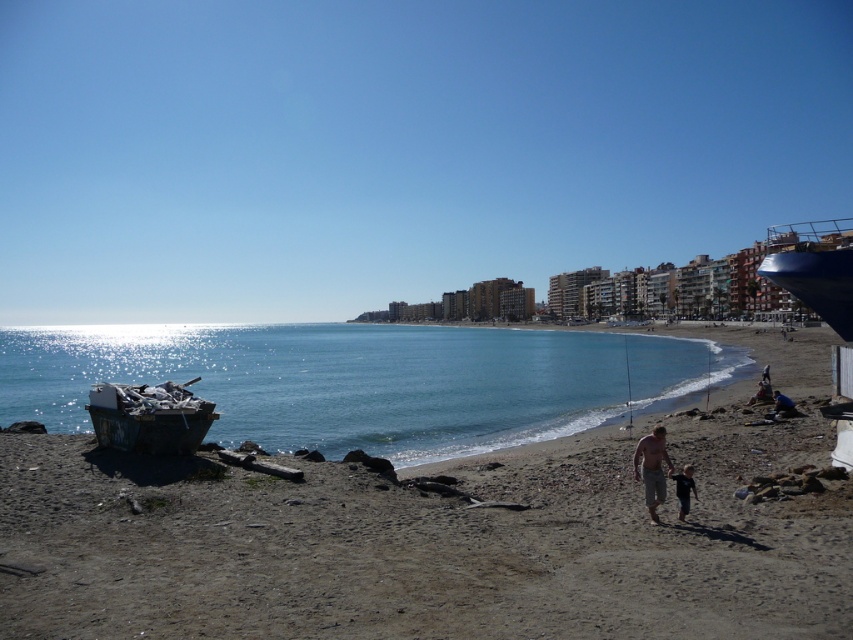
Between point (166, 435) and point (691, 474), which one is positioned behind?

The point (166, 435) is more distant.

Can you confirm if rusty metal boat at left is positioned below black matte shorts at lower right?

No, rusty metal boat at left is not below black matte shorts at lower right.

Locate an element on the screen. The image size is (853, 640). rusty metal boat at left is located at coordinates (149, 417).

Which of these two, rusty metal boat at left or tan skin man at center, stands taller?

tan skin man at center is taller.

Between point (149, 388) and point (646, 461), which one is positioned in front?

Point (646, 461)

Locate an element on the screen. rusty metal boat at left is located at coordinates (149, 417).

Who is positioned more to the left, brown sand at lower left or black matte shorts at lower right?

Positioned to the left is black matte shorts at lower right.

In the scene shown: Is brown sand at lower left behind black matte shorts at lower right?

That is False.

Locate an element on the screen. The width and height of the screenshot is (853, 640). brown sand at lower left is located at coordinates (439, 536).